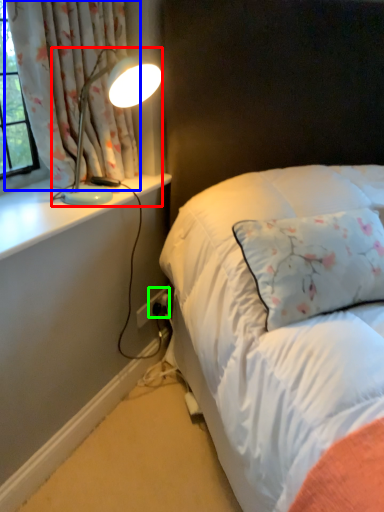
Question: Which is nearer to the lamp (highlighted by a red box)? curtain (highlighted by a blue box) or electric outlet (highlighted by a green box).

Choices:
 (A) curtain
 (B) electric outlet

Answer: (A)